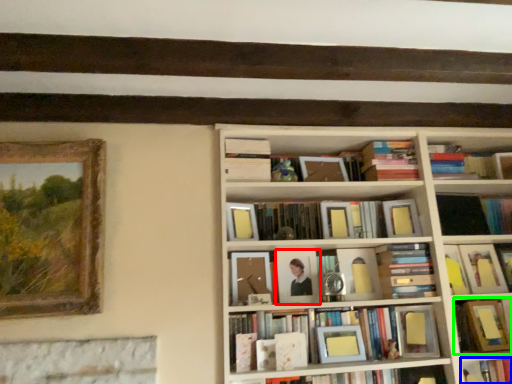
Question: Which is farther away from picture frame (highlighted by a red box)? book (highlighted by a blue box) or book (highlighted by a green box)?

Choices:
 (A) book
 (B) book

Answer: (A)